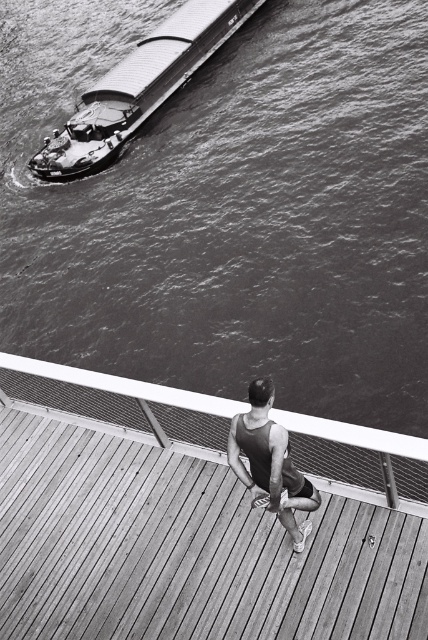
Question: Is wooden at center closer to the viewer compared to metallic gray barge at upper left?

Choices:
 (A) yes
 (B) no

Answer: (A)

Question: Which object appears closest to the camera in this image?

Choices:
 (A) matte black tank top at center
 (B) metallic gray barge at upper left

Answer: (A)

Question: Which point is closer to the camera?

Choices:
 (A) matte black tank top at center
 (B) metallic gray barge at upper left
 (C) smooth water at upper left

Answer: (A)

Question: Is wooden at center further to the viewer compared to metallic gray barge at upper left?

Choices:
 (A) yes
 (B) no

Answer: (B)

Question: Is wooden at center behind metallic gray barge at upper left?

Choices:
 (A) yes
 (B) no

Answer: (B)

Question: Which point is closer to the camera?

Choices:
 (A) (279, 35)
 (B) (287, 451)
 (C) (193, 32)

Answer: (B)